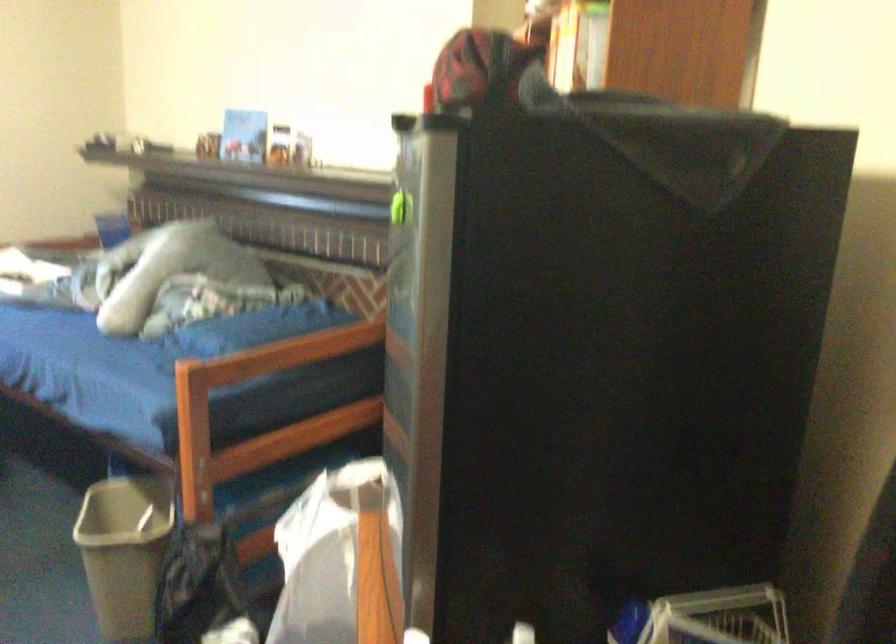
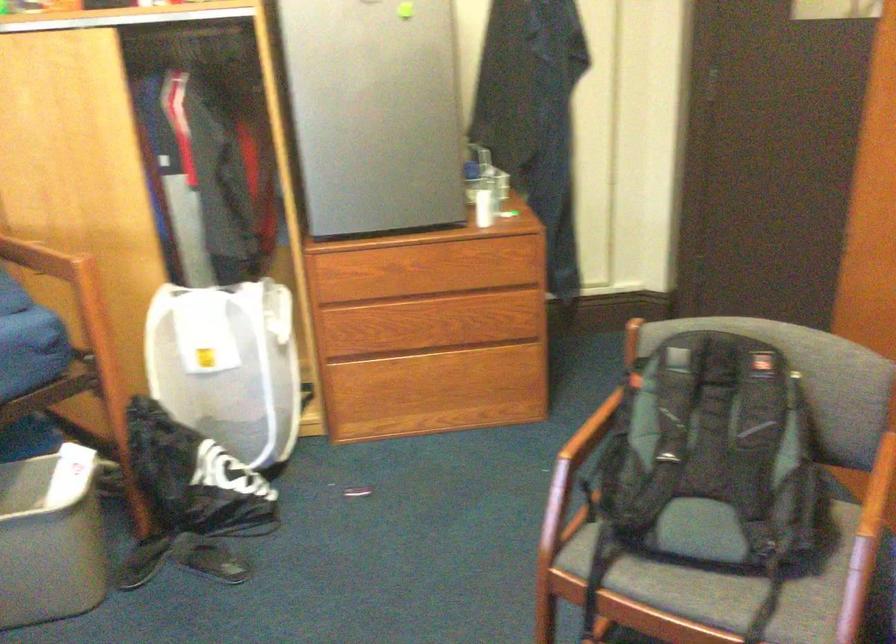
The point at (95,552) is marked in the first image. Where is the corresponding point in the second image?

(49, 538)